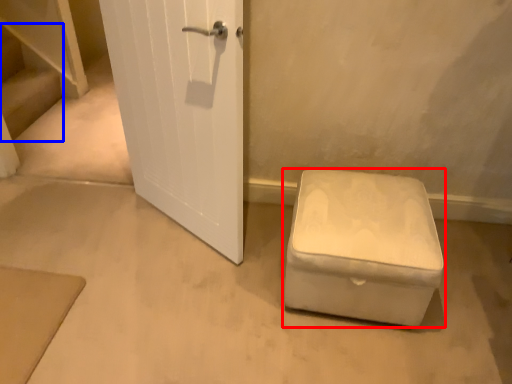
Question: Which of the following is the farthest to the observer, furniture (highlighted by a red box) or stairwell (highlighted by a blue box)?

Choices:
 (A) furniture
 (B) stairwell

Answer: (B)